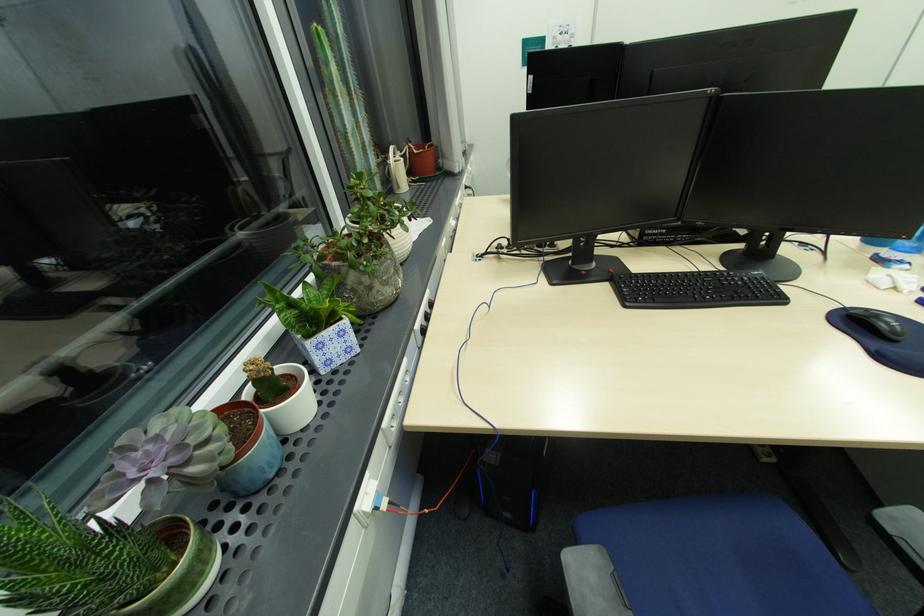
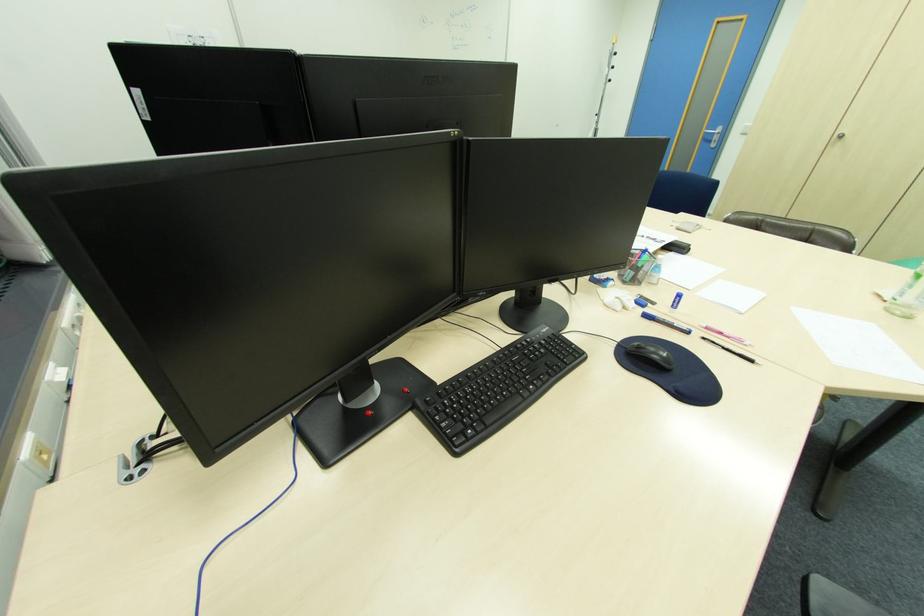
In the second image, find the point that corresponds to [736,274] in the first image.

(533, 339)